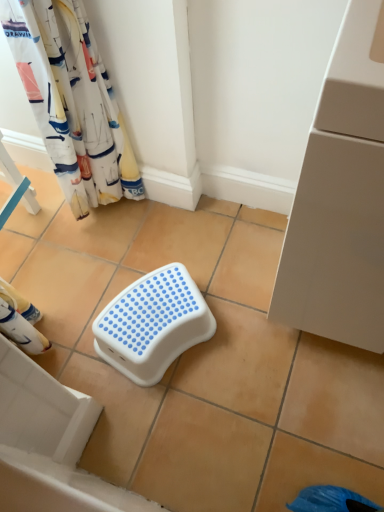
Describe the element at coordinates (70, 103) in the screenshot. This screenshot has height=512, width=384. I see `white fabric curtain at upper left` at that location.

Where is `white fabric curtain at upper left`? white fabric curtain at upper left is located at coordinates (70, 103).

What do you see at coordinates (153, 324) in the screenshot? I see `white plastic step stool at center` at bounding box center [153, 324].

Measure the distance between point (181, 316) and camera.

Point (181, 316) is 1.16 meters from camera.

Where is `white plastic step stool at center`? The width and height of the screenshot is (384, 512). white plastic step stool at center is located at coordinates (153, 324).

Where is `white fabric curtain at upper left`? white fabric curtain at upper left is located at coordinates (70, 103).

Considering the positions of objects white fabric curtain at upper left and white plastic step stool at center in the image provided, who is more to the right, white fabric curtain at upper left or white plastic step stool at center?

Positioned to the right is white plastic step stool at center.

Is white fabric curtain at upper left positioned before white plastic step stool at center?

Yes, white fabric curtain at upper left is closer to the viewer.

Is point (83, 170) positioned after point (196, 290)?

Yes, point (83, 170) is behind point (196, 290).

Based on the photo, from the image's perspective, which one is positioned lower, white fabric curtain at upper left or white plastic step stool at center?

white plastic step stool at center.

From a real-world perspective, relative to white plastic step stool at center, is white fabric curtain at upper left vertically above or below?

white fabric curtain at upper left is situated higher than white plastic step stool at center in the real world.

Does white fabric curtain at upper left have a greater width compared to white plastic step stool at center?

No.

Can you confirm if white fabric curtain at upper left is shorter than white plastic step stool at center?

No, white fabric curtain at upper left is not shorter than white plastic step stool at center.

Between white fabric curtain at upper left and white plastic step stool at center, which one has larger size?

With larger size is white fabric curtain at upper left.

Is white fabric curtain at upper left inside the boundaries of white plastic step stool at center, or outside?

white fabric curtain at upper left lies outside white plastic step stool at center.

Are white fabric curtain at upper left and white plastic step stool at center far apart?

Actually, white fabric curtain at upper left and white plastic step stool at center are a little close together.

Is white fabric curtain at upper left positioned with its back to white plastic step stool at center?

That's not correct — white fabric curtain at upper left is not looking away from white plastic step stool at center.

Where is `step stool beneath the white fabric curtain at upper left (from a real-world perspective)`? step stool beneath the white fabric curtain at upper left (from a real-world perspective) is located at coordinates coord(153,324).

Consider the image. Considering the relative positions of white plastic step stool at center and white fabric curtain at upper left in the image provided, is white plastic step stool at center to the left of white fabric curtain at upper left from the viewer's perspective?

No.

Between white plastic step stool at center and white fabric curtain at upper left, which one is positioned in front?

white fabric curtain at upper left is more forward.

Is point (193, 305) positioned after point (94, 109)?

No.

From the image's perspective, is white plastic step stool at center above or below white fabric curtain at upper left?

Based on their image positions, white plastic step stool at center is located beneath white fabric curtain at upper left.

From a real-world perspective, which object rests below the other?

In real-world perspective, white plastic step stool at center is lower.

Between white plastic step stool at center and white fabric curtain at upper left, which one has smaller width?

Thinner between the two is white fabric curtain at upper left.

Considering the relative sizes of white plastic step stool at center and white fabric curtain at upper left in the image provided, is white plastic step stool at center taller than white fabric curtain at upper left?

No, white plastic step stool at center is not taller than white fabric curtain at upper left.

Between white plastic step stool at center and white fabric curtain at upper left, which one has larger size?

With larger size is white fabric curtain at upper left.

Is white plastic step stool at center positioned beyond the bounds of white fabric curtain at upper left?

Yes, white plastic step stool at center is outside of white fabric curtain at upper left.

Is white plastic step stool at center not near white fabric curtain at upper left?

No, white plastic step stool at center is not far from white fabric curtain at upper left.

Is white plastic step stool at center oriented away from white fabric curtain at upper left?

No.

In order to click on curtain in front of the white plastic step stool at center in this screenshot , I will do `click(70, 103)`.

You are a GUI agent. You are given a task and a screenshot of the screen. Output one action in this format:
    pyautogui.click(x=<x>, y=<y>)
    Task: Click on the curtain above the white plastic step stool at center (from the image's perspective)
    This screenshot has width=384, height=512.
    Given the screenshot: What is the action you would take?
    pyautogui.click(x=70, y=103)

At what (x,y) coordinates should I click in order to perform the action: click on step stool on the right side of white fabric curtain at upper left. Please return your answer as a coordinate pair (x, y). The height and width of the screenshot is (512, 384). Looking at the image, I should click on (153, 324).